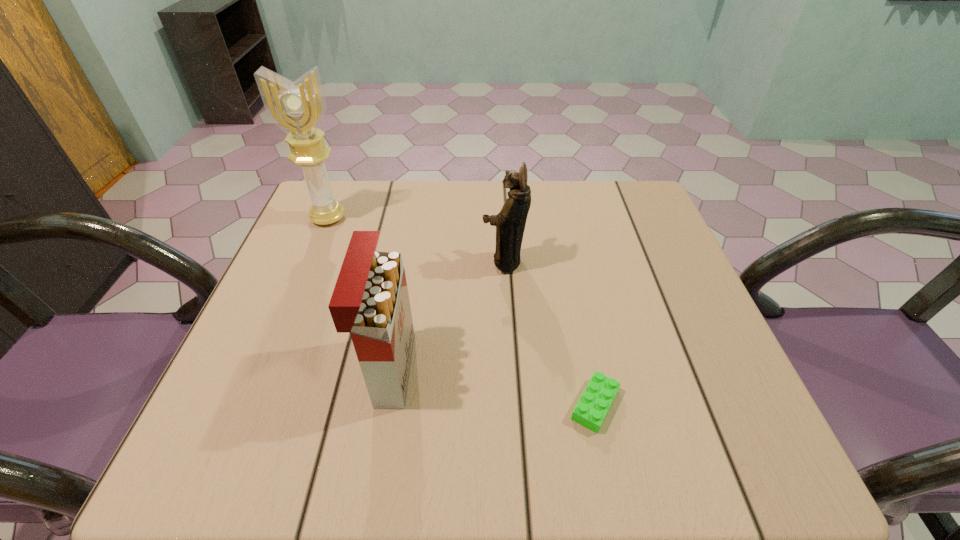
Image resolution: width=960 pixels, height=540 pixels. I want to click on free space located 0.310m on the front-facing side of the figurine, so click(348, 261).

I want to click on vacant space located 0.350m on the front-facing side of the figurine, so click(x=331, y=261).

You are a GUI agent. You are given a task and a screenshot of the screen. Output one action in this format:
    pyautogui.click(x=<x>, y=<y>)
    Task: Click on the blank space located on the back of the shortest object
    The height and width of the screenshot is (540, 960).
    Given the screenshot: What is the action you would take?
    pyautogui.click(x=565, y=261)

Identify the location of object at the far edge. (298, 108).

Where is `object that is at the near edge`? object that is at the near edge is located at coordinates (596, 400).

This screenshot has height=540, width=960. What are the coordinates of `object present at the left edge` in the screenshot? It's located at (298, 108).

Image resolution: width=960 pixels, height=540 pixels. In order to click on object at the far left corner in this screenshot , I will do `click(298, 108)`.

Image resolution: width=960 pixels, height=540 pixels. What are the coordinates of `vacant space at the far edge` in the screenshot? It's located at (548, 219).

Identify the location of free space at the near edge of the desktop. (471, 468).

Identify the location of vacant space at the left edge of the desktop. This screenshot has height=540, width=960. (256, 399).